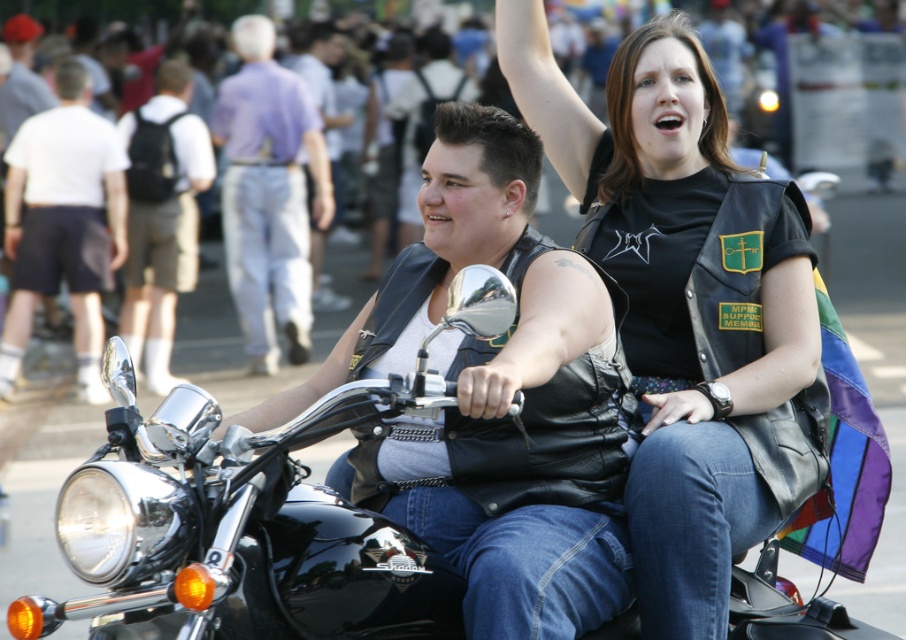
Is point (702, 80) closer to viewer compared to point (425, 440)?

No, (702, 80) is behind (425, 440).

Where is `black leather vest at upper center`? The image size is (906, 640). black leather vest at upper center is located at coordinates (688, 307).

Who is positioned more to the left, black leather vest at center or light purple shirt at center?

From the viewer's perspective, light purple shirt at center appears more on the left side.

Who is lower down, black leather vest at center or light purple shirt at center?

Positioned lower is black leather vest at center.

Is point (496, 550) positioned in front of point (297, 112)?

Yes, it is.

Find the location of a particular element. black leather vest at center is located at coordinates (496, 397).

Can you confirm if white cotton shorts at left is taller than dark brown backpack at left?

Incorrect, white cotton shorts at left's height is not larger of dark brown backpack at left's.

Is white cotton shorts at left bigger than dark brown backpack at left?

Incorrect, white cotton shorts at left is not larger than dark brown backpack at left.

Does point (54, 234) come in front of point (135, 324)?

Yes, it is.

Where is `white cotton shorts at left`? white cotton shorts at left is located at coordinates (63, 224).